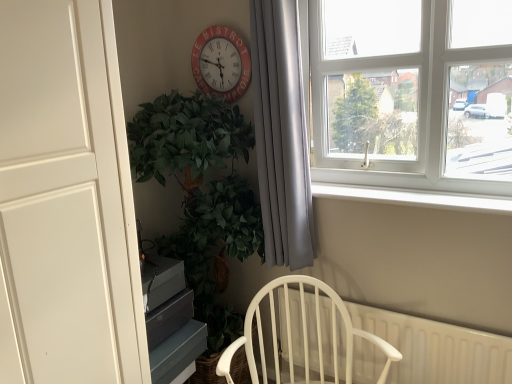
Question: From a real-world perspective, does white matte door at left sit lower than silky gray curtain at center?

Choices:
 (A) no
 (B) yes

Answer: (B)

Question: Does white matte door at left have a greater width compared to silky gray curtain at center?

Choices:
 (A) no
 (B) yes

Answer: (B)

Question: Does white matte door at left have a lesser height compared to silky gray curtain at center?

Choices:
 (A) no
 (B) yes

Answer: (A)

Question: Is white matte door at left at the right side of silky gray curtain at center?

Choices:
 (A) yes
 (B) no

Answer: (B)

Question: Is white matte door at left taller than silky gray curtain at center?

Choices:
 (A) yes
 (B) no

Answer: (A)

Question: From the image's perspective, does white matte door at left appear lower than silky gray curtain at center?

Choices:
 (A) no
 (B) yes

Answer: (B)

Question: Is silky gray curtain at center inside white plastic radiator at lower right?

Choices:
 (A) yes
 (B) no

Answer: (B)

Question: Considering the relative sizes of white plastic radiator at lower right and silky gray curtain at center in the image provided, is white plastic radiator at lower right taller than silky gray curtain at center?

Choices:
 (A) no
 (B) yes

Answer: (A)

Question: Considering the relative sizes of white plastic radiator at lower right and silky gray curtain at center in the image provided, is white plastic radiator at lower right thinner than silky gray curtain at center?

Choices:
 (A) yes
 (B) no

Answer: (A)

Question: From a real-world perspective, does white plastic radiator at lower right stand above silky gray curtain at center?

Choices:
 (A) no
 (B) yes

Answer: (A)

Question: Is white plastic radiator at lower right positioned before silky gray curtain at center?

Choices:
 (A) no
 (B) yes

Answer: (A)

Question: Can you confirm if white plastic radiator at lower right is positioned to the right of silky gray curtain at center?

Choices:
 (A) no
 (B) yes

Answer: (B)

Question: From a real-world perspective, is white wood chair at lower center below white plastic radiator at lower right?

Choices:
 (A) yes
 (B) no

Answer: (B)